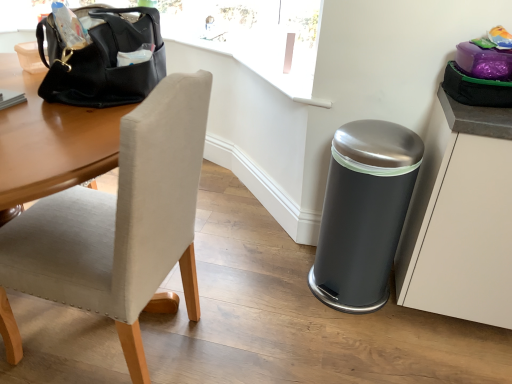
You are a GUI agent. You are given a task and a screenshot of the screen. Output one action in this format:
    pyautogui.click(x=<x>, y=<y>)
    Task: Click on the free space to the left of white matte cabinet at right
    The width and height of the screenshot is (512, 384).
    Given the screenshot: What is the action you would take?
    pyautogui.click(x=348, y=320)